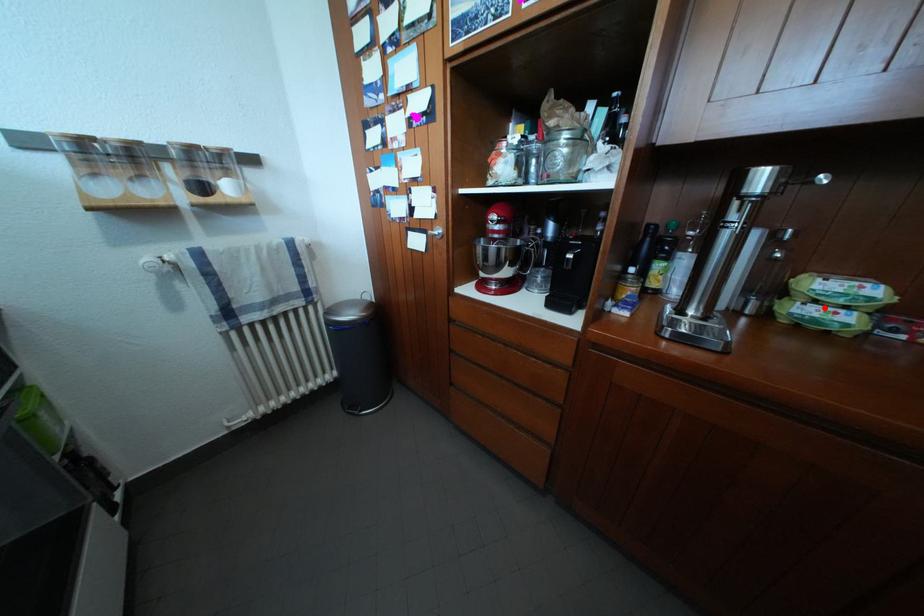
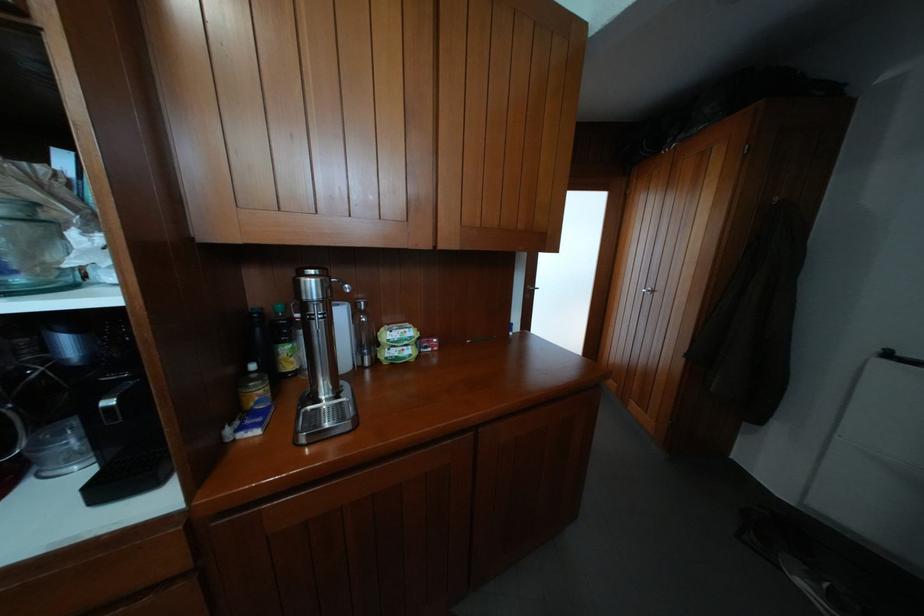
Locate, in the second image, the point that corresponds to the highlighted location in the first image.

(403, 352)